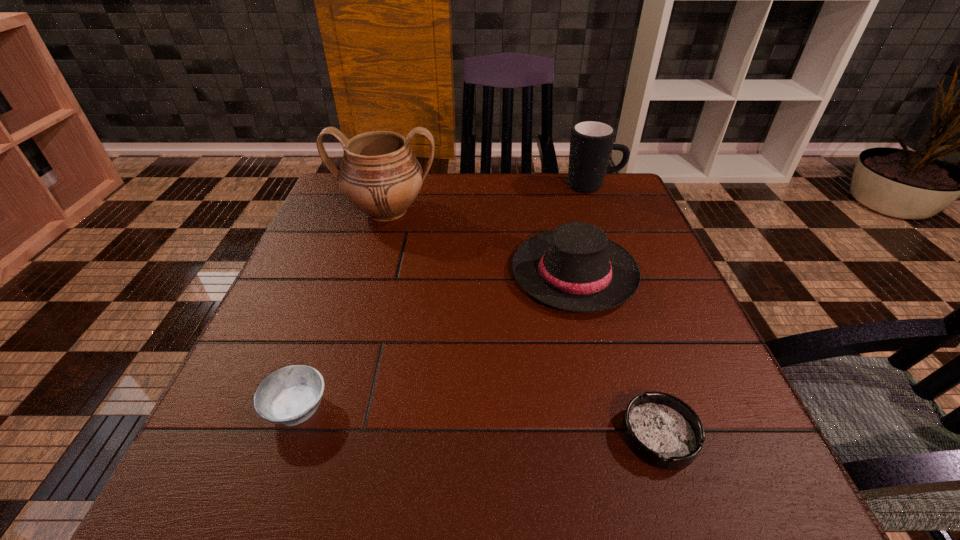
Image resolution: width=960 pixels, height=540 pixels. I want to click on vacant space that's between the urn and the shorter ashtray, so click(523, 323).

Identify the location of vacant point located between the right ashtray and the second shortest object. The height and width of the screenshot is (540, 960). (478, 422).

The image size is (960, 540). In order to click on free space between the left ashtray and the tallest object in this screenshot , I will do click(x=342, y=310).

You are a GUI agent. You are given a task and a screenshot of the screen. Output one action in this format:
    pyautogui.click(x=<x>, y=<y>)
    Task: Click on the empty location between the urn and the fourth shortest object
    The image size is (960, 540).
    Given the screenshot: What is the action you would take?
    pyautogui.click(x=490, y=199)

Find the location of a particular element. This screenshot has height=540, width=960. free point between the right ashtray and the second tallest object is located at coordinates (626, 310).

In order to click on free space between the tallest object and the taller ashtray in this screenshot , I will do 342,310.

The width and height of the screenshot is (960, 540). I want to click on empty space between the dress hat and the taller ashtray, so click(x=436, y=341).

Locate which object ranks fourth in proximity to the third farthest object. Please provide its 2D coordinates. Your answer should be formatted as a tuple, i.e. [(x, y)], where the tuple contains the x and y coordinates of a point satisfying the conditions above.

[(289, 396)]

Where is `object that can be found as the closest to the second tallest object`? The width and height of the screenshot is (960, 540). object that can be found as the closest to the second tallest object is located at coordinates (576, 268).

Where is `free space that satisfies the following two spatial constraints: 1. on the back side of the dress hat; 2. on the right side of the taller ashtray`? free space that satisfies the following two spatial constraints: 1. on the back side of the dress hat; 2. on the right side of the taller ashtray is located at coordinates (345, 273).